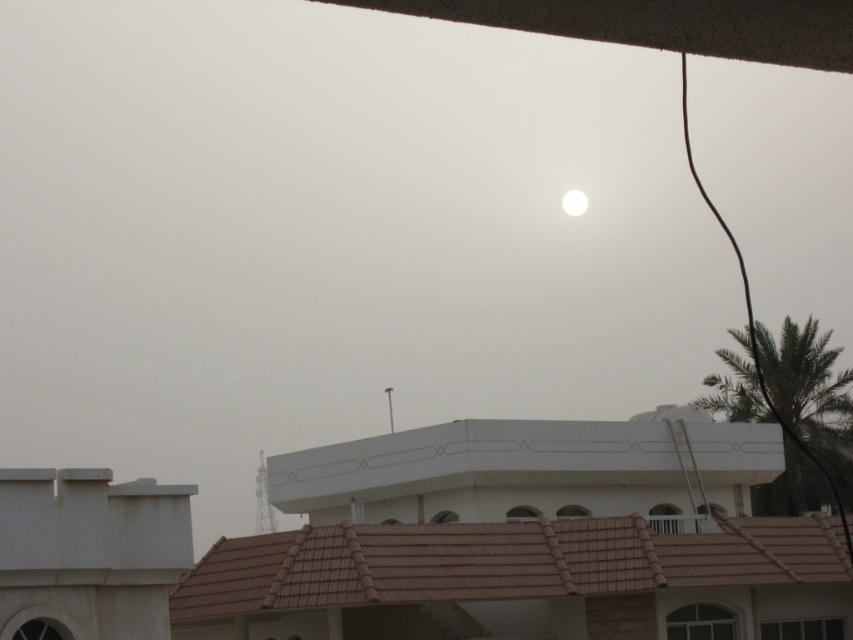
In the scene shown: How distant is green leafy palm tree at upper right from white glossy moon at upper center?

green leafy palm tree at upper right is 61.02 meters from white glossy moon at upper center.

Based on the photo, is green leafy palm tree at upper right wider than white glossy moon at upper center?

Indeed, green leafy palm tree at upper right has a greater width compared to white glossy moon at upper center.

The width and height of the screenshot is (853, 640). I want to click on green leafy palm tree at upper right, so click(x=811, y=394).